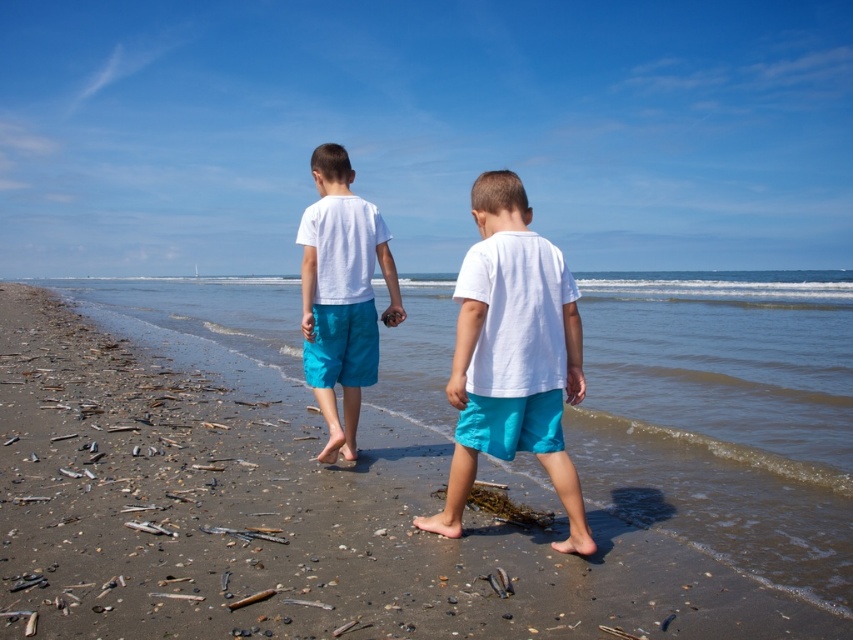
Is matte white t-shirt at center to the right of white matte shorts at center from the viewer's perspective?

Indeed, matte white t-shirt at center is positioned on the right side of white matte shorts at center.

Can you confirm if matte white t-shirt at center is taller than white matte shorts at center?

No.

Does point (508, 452) come closer to viewer compared to point (309, 262)?

Yes.

Locate an element on the screen. The width and height of the screenshot is (853, 640). matte white t-shirt at center is located at coordinates (512, 355).

Between point (27, 337) and point (477, 259), which one is positioned behind?

Point (27, 337)

Is smooth sand at center wider than matte white t-shirt at center?

Yes, smooth sand at center is wider than matte white t-shirt at center.

Who is more forward, (567, 586) or (519, 292)?

Positioned in front is point (567, 586).

You are a GUI agent. You are given a task and a screenshot of the screen. Output one action in this format:
    pyautogui.click(x=<x>, y=<y>)
    Task: Click on the smooth sand at center
    
    Given the screenshot: What is the action you would take?
    pyautogui.click(x=283, y=515)

Is smooth sand at center wider than white matte shorts at center?

Correct, the width of smooth sand at center exceeds that of white matte shorts at center.

Which is behind, point (310, 442) or point (344, 280)?

The point (310, 442) is behind.

The width and height of the screenshot is (853, 640). I want to click on smooth sand at center, so click(x=283, y=515).